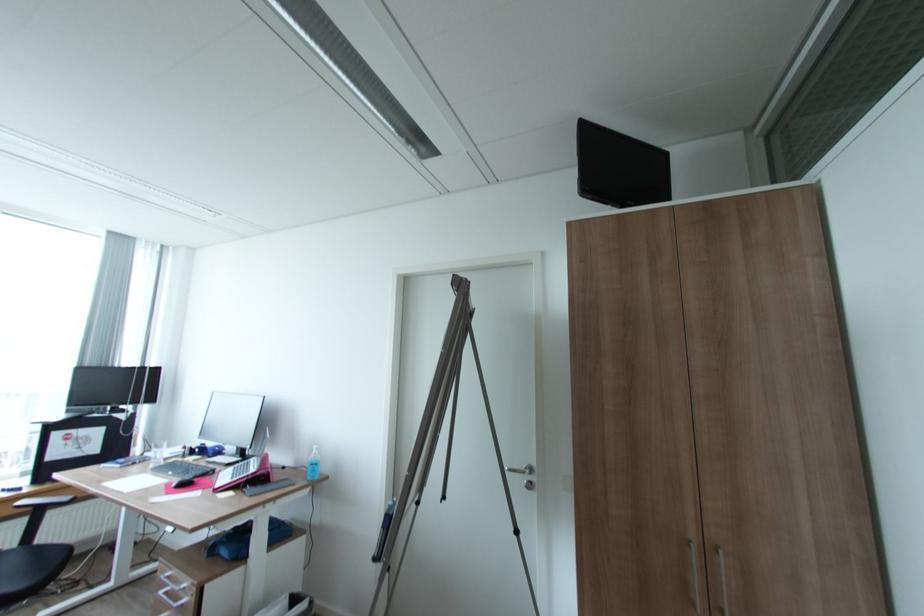
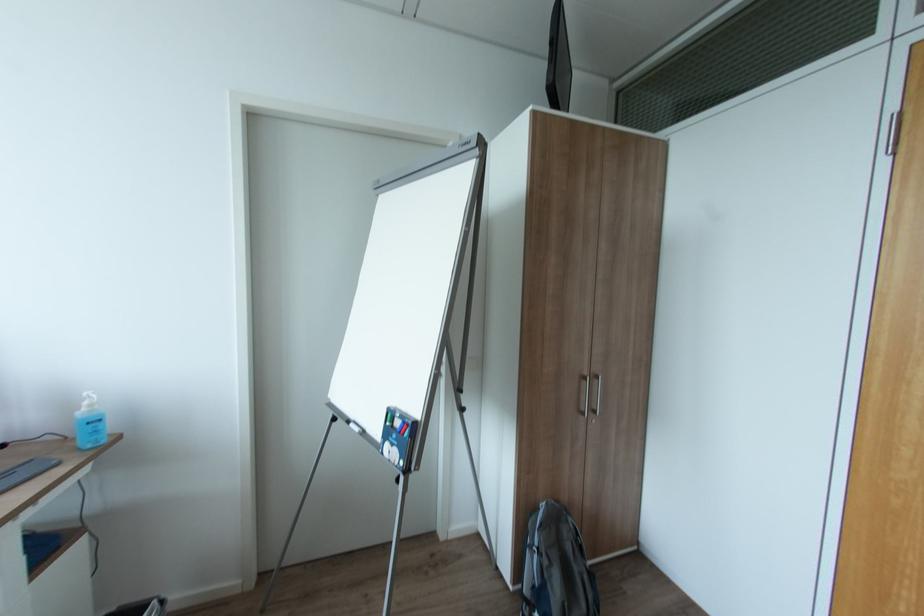
Question: The camera is either moving clockwise (left) or counter-clockwise (right) around the object. The first image is from the beginning of the video and the second image is from the end. Is the camera moving left or right when shooting the video?

Choices:
 (A) Left
 (B) Right

Answer: (A)